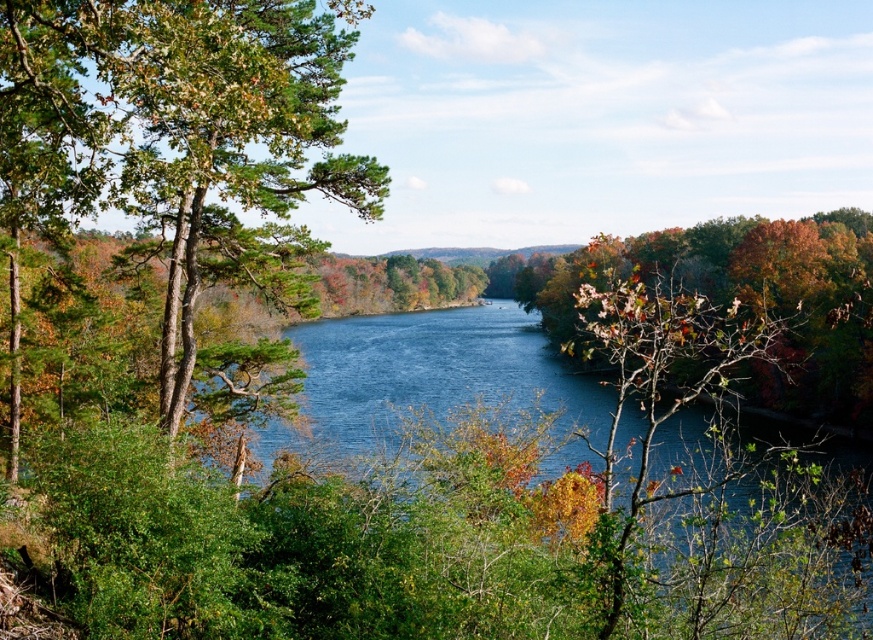
Question: Which object appears closest to the camera in this image?

Choices:
 (A) autumn leaves at right
 (B) green matte tree at left

Answer: (A)

Question: Does green matte tree at left appear under autumn leaves at right?

Choices:
 (A) yes
 (B) no

Answer: (B)

Question: Can you confirm if green matte tree at left is positioned below autumn leaves at right?

Choices:
 (A) yes
 (B) no

Answer: (B)

Question: Among these points, which one is nearest to the camera?

Choices:
 (A) (575, 276)
 (B) (91, 28)

Answer: (B)

Question: Can you confirm if green matte tree at left is positioned to the left of autumn leaves at right?

Choices:
 (A) no
 (B) yes

Answer: (B)

Question: Which of the following is the closest to the observer?

Choices:
 (A) (652, 288)
 (B) (224, 250)

Answer: (A)